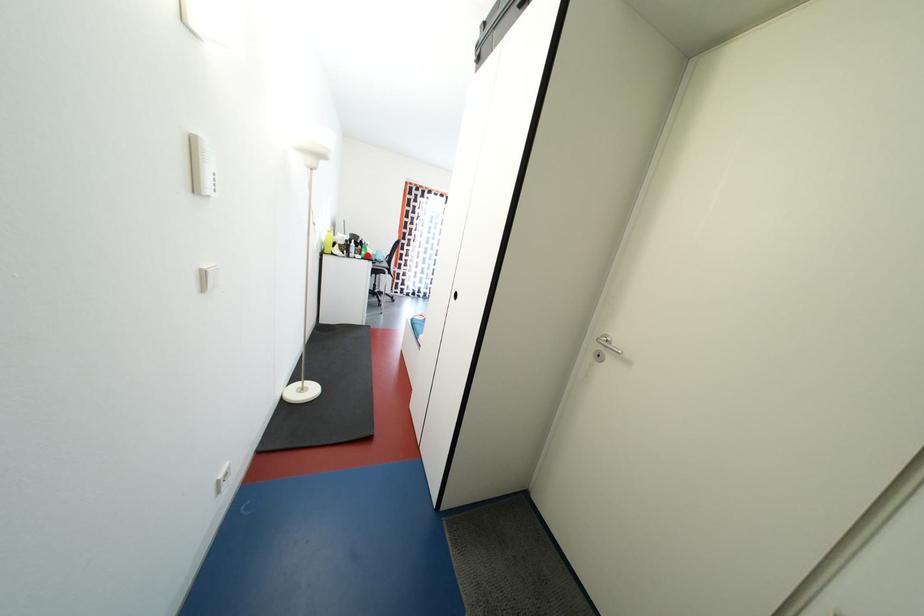
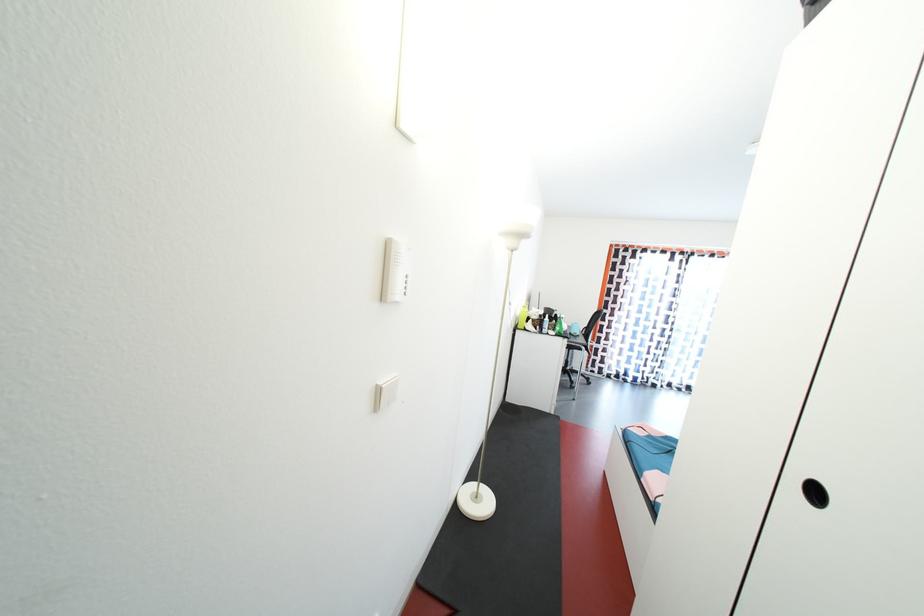
Question: I am providing you with two images of the same scene from different viewpoints. In image1, a red point is highlighted. Considering the same 3D point in image2, which of the following is correct?

Choices:
 (A) It is closer
 (B) It is farther

Answer: (B)